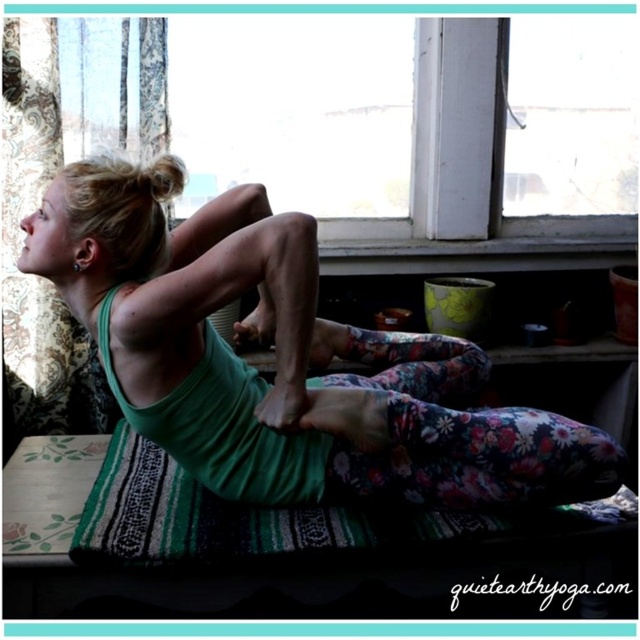
Question: Does green fabric yoga mat at center appear over green woven yoga mat at lower center?

Choices:
 (A) no
 (B) yes

Answer: (B)

Question: Considering the relative positions of green fabric yoga mat at center and green woven yoga mat at lower center in the image provided, where is green fabric yoga mat at center located with respect to green woven yoga mat at lower center?

Choices:
 (A) right
 (B) left

Answer: (B)

Question: Can you confirm if green fabric yoga mat at center is wider than green woven yoga mat at lower center?

Choices:
 (A) yes
 (B) no

Answer: (B)